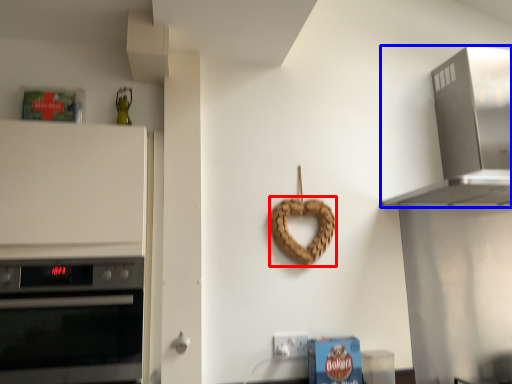
Question: Among these objects, which one is nearest to the camera, pretzel (highlighted by a red box) or home appliance (highlighted by a blue box)?

Choices:
 (A) pretzel
 (B) home appliance

Answer: (B)